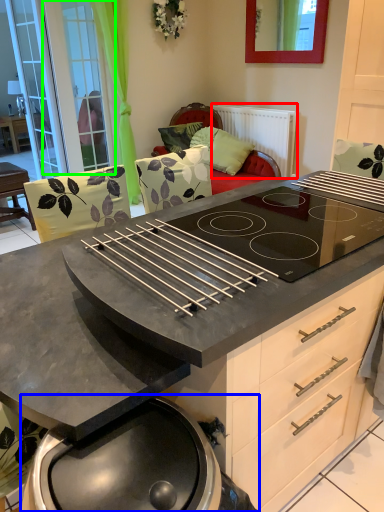
Question: Based on their relative distances, which object is farther from radiator (highlighted by a red box)? Choose from barbecue grill (highlighted by a blue box) and screen door (highlighted by a green box).

Choices:
 (A) barbecue grill
 (B) screen door

Answer: (A)